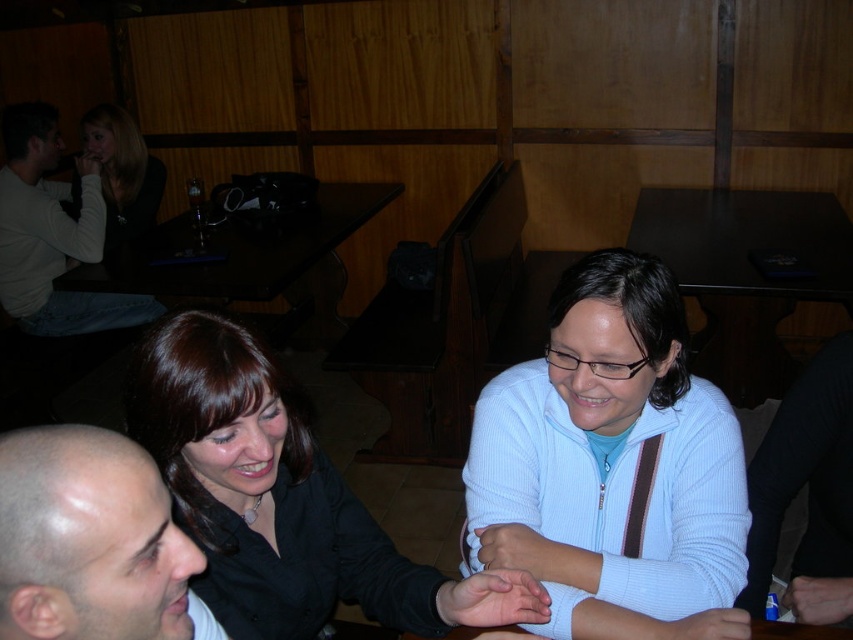
Question: Which point appears farthest from the camera in this image?

Choices:
 (A) (711, 243)
 (B) (318, 586)
 (C) (146, 157)

Answer: (C)

Question: Considering the relative positions of black glossy table at center and black glass table at upper left in the image provided, where is black glossy table at center located with respect to black glass table at upper left?

Choices:
 (A) above
 (B) below

Answer: (B)

Question: Is bald head at lower left behind matte black hair at upper left?

Choices:
 (A) no
 (B) yes

Answer: (A)

Question: Is light blue denim jeans at upper left behind black glass table at upper left?

Choices:
 (A) no
 (B) yes

Answer: (B)

Question: Which object appears farthest from the camera in this image?

Choices:
 (A) light blue zip-up sweater at center
 (B) black glass table at upper left
 (C) light blue denim jeans at upper left

Answer: (C)

Question: Which of the following is the farthest from the observer?

Choices:
 (A) matte black hair at upper left
 (B) black glass table at upper left
 (C) bald head at lower left

Answer: (A)